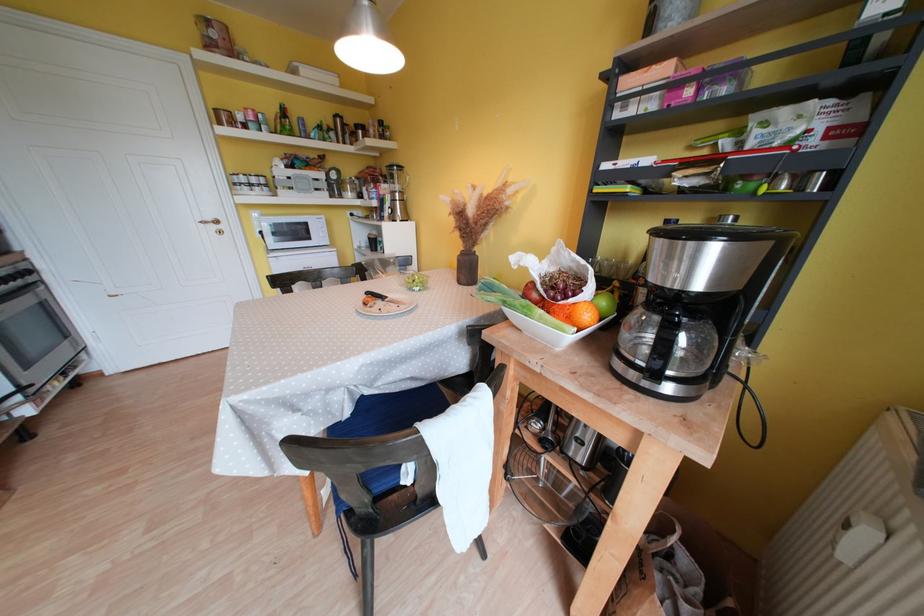
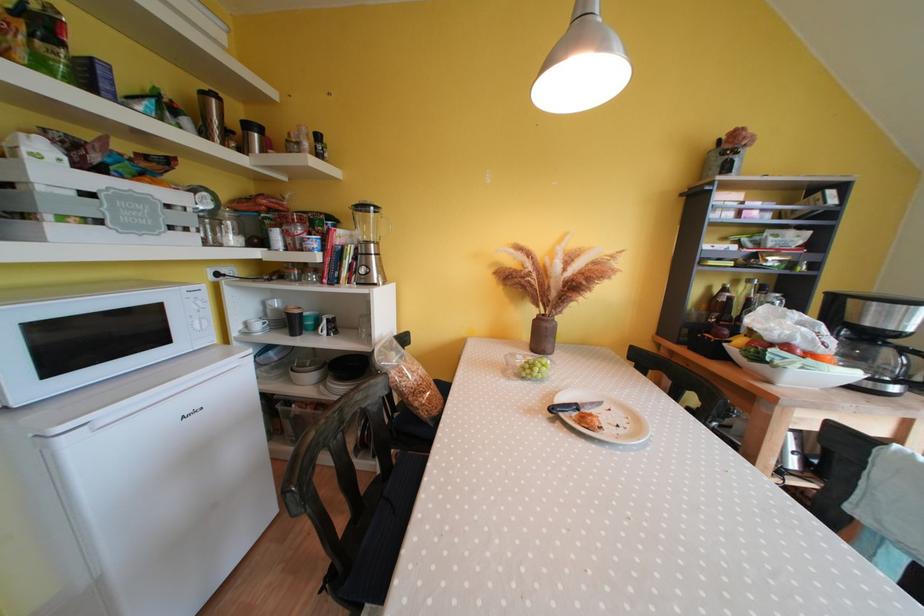
Locate, in the second image, the point that corresponds to the point at 390,301 in the first image.

(582, 410)